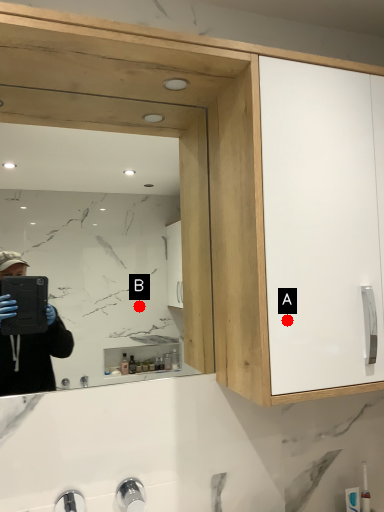
Question: Two points are circled on the image, labeled by A and B beside each circle. Among these points, which one is nearest to the camera?

Choices:
 (A) A is closer
 (B) B is closer

Answer: (A)